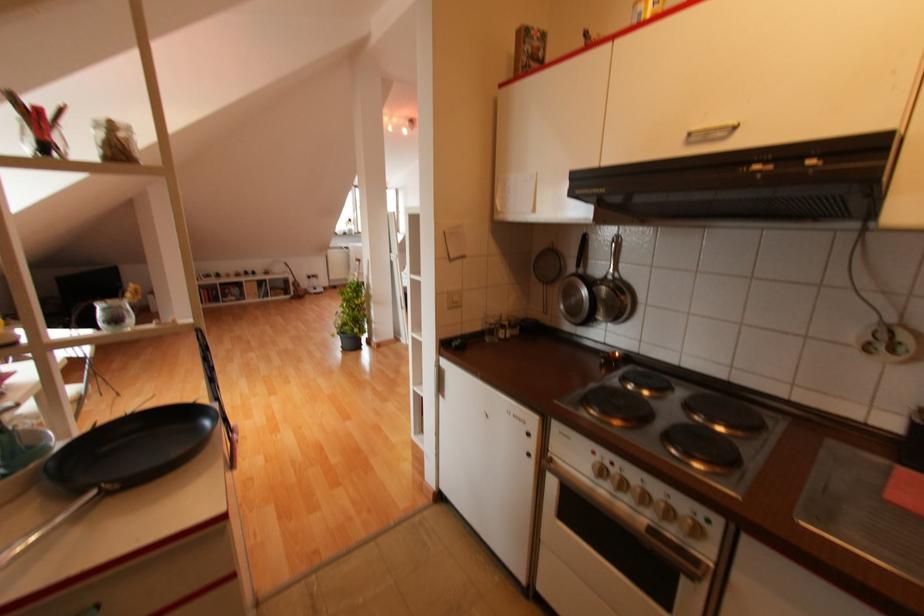
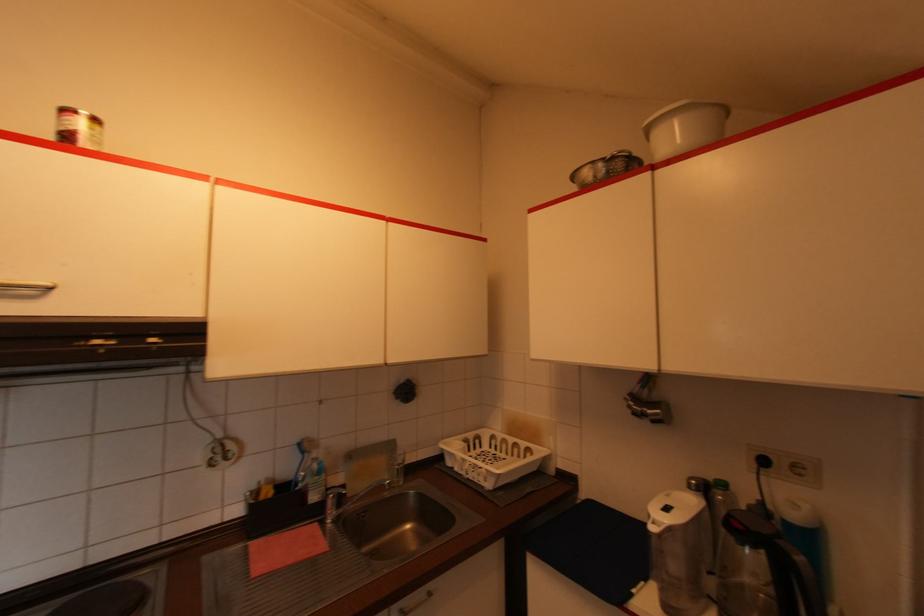
Where in the second image is the point corresponding to point 736,128 from the first image?

(47, 289)